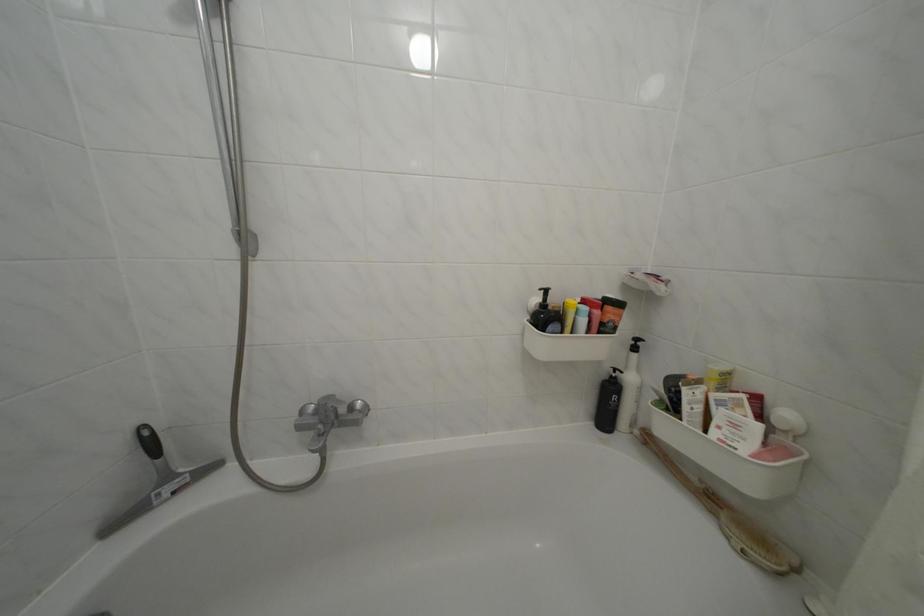
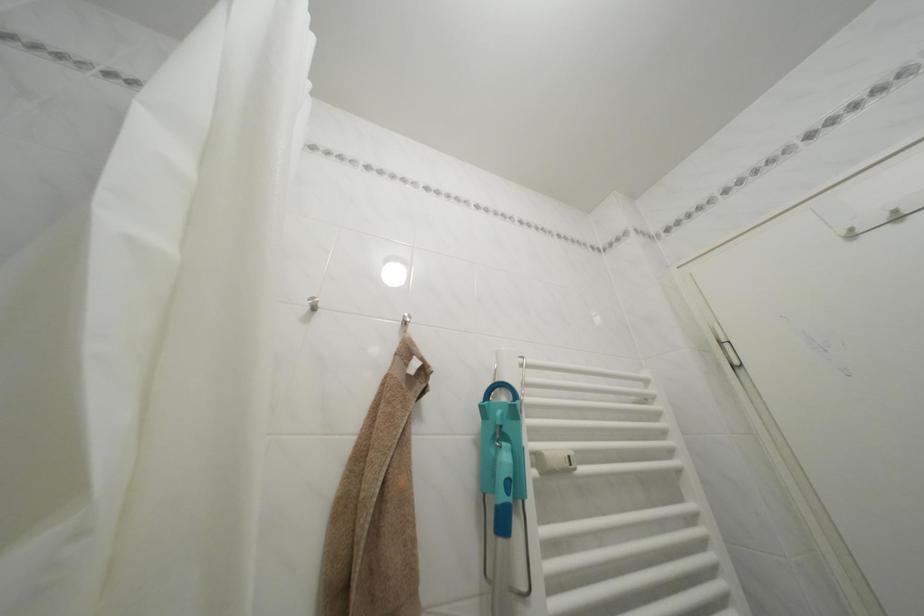
How did the camera likely rotate?

The rotation direction of the camera is right-up.